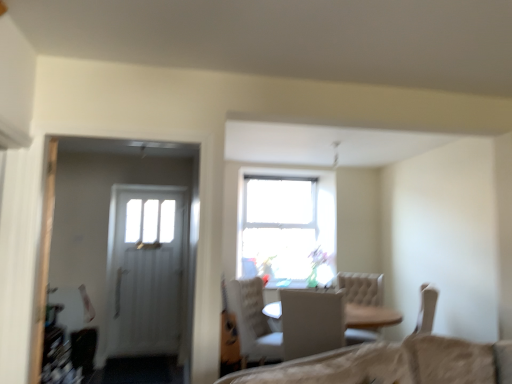
Measure the distance between white textured chair at center, the 2th chair viewed from the front, and camera.

The distance of white textured chair at center, the 2th chair viewed from the front, from camera is 11.11 feet.

Measure the distance between point (273, 335) and camera.

Point (273, 335) and camera are 3.92 meters apart from each other.

How much space does white textured chair at center, positioned as the first chair in back-to-front order, occupy horizontally?

white textured chair at center, positioned as the first chair in back-to-front order, is 25.03 inches in width.

The height and width of the screenshot is (384, 512). Describe the element at coordinates (253, 321) in the screenshot. I see `white textured chair at center, positioned as the first chair in back-to-front order` at that location.

Where is `white textured chair at center, positioned as the first chair in back-to-front order`? The height and width of the screenshot is (384, 512). white textured chair at center, positioned as the first chair in back-to-front order is located at coordinates (253, 321).

Image resolution: width=512 pixels, height=384 pixels. What do you see at coordinates (311, 322) in the screenshot?
I see `white fabric chair at center, the 1th chair when ordered from front to back` at bounding box center [311, 322].

The height and width of the screenshot is (384, 512). What are the coordinates of `white fabric chair at center, which ranks as the 2th chair in back-to-front order` in the screenshot? It's located at (311, 322).

Measure the distance between point (325, 304) and camera.

A distance of 10.04 feet exists between point (325, 304) and camera.

Where is `white textured chair at center, positioned as the first chair in back-to-front order`? The width and height of the screenshot is (512, 384). white textured chair at center, positioned as the first chair in back-to-front order is located at coordinates (253, 321).

Is white fabric chair at center, which ranks as the 2th chair in back-to-front order, to the left of white textured chair at center, the 2th chair viewed from the front, from the viewer's perspective?

Incorrect, white fabric chair at center, which ranks as the 2th chair in back-to-front order, is not on the left side of white textured chair at center, the 2th chair viewed from the front.

Which is behind, white fabric chair at center, which ranks as the 2th chair in back-to-front order, or white textured chair at center, the 2th chair viewed from the front?

white textured chair at center, the 2th chair viewed from the front, is more distant.

Considering the positions of point (303, 356) and point (256, 337), is point (303, 356) closer or farther from the camera than point (256, 337)?

Clearly, point (303, 356) is closer to the camera than point (256, 337).

From the image's perspective, relative to white textured chair at center, positioned as the first chair in back-to-front order, is white fabric chair at center, which ranks as the 2th chair in back-to-front order, above or below?

white fabric chair at center, which ranks as the 2th chair in back-to-front order, is situated higher than white textured chair at center, positioned as the first chair in back-to-front order, in the image.

From a real-world perspective, which object rests below the other?

white textured chair at center, the 2th chair viewed from the front, from a real-world perspective.

Is white fabric chair at center, which ranks as the 2th chair in back-to-front order, wider or thinner than white textured chair at center, the 2th chair viewed from the front?

In the image, white fabric chair at center, which ranks as the 2th chair in back-to-front order, appears to be wider than white textured chair at center, the 2th chair viewed from the front.

Does white fabric chair at center, which ranks as the 2th chair in back-to-front order, have a greater height compared to white textured chair at center, the 2th chair viewed from the front?

No, white fabric chair at center, which ranks as the 2th chair in back-to-front order, is not taller than white textured chair at center, the 2th chair viewed from the front.

Considering the relative sizes of white fabric chair at center, the 1th chair when ordered from front to back, and white textured chair at center, positioned as the first chair in back-to-front order, in the image provided, is white fabric chair at center, the 1th chair when ordered from front to back, smaller than white textured chair at center, positioned as the first chair in back-to-front order,?

Yes.

Is white fabric chair at center, the 1th chair when ordered from front to back, positioned beyond the bounds of white textured chair at center, the 2th chair viewed from the front?

Yes, white fabric chair at center, the 1th chair when ordered from front to back, is not within white textured chair at center, the 2th chair viewed from the front.

Are white fabric chair at center, the 1th chair when ordered from front to back, and white textured chair at center, positioned as the first chair in back-to-front order, located far from each other?

No, white fabric chair at center, the 1th chair when ordered from front to back, is not far away from white textured chair at center, positioned as the first chair in back-to-front order.

Is white fabric chair at center, the 1th chair when ordered from front to back, turned away from white textured chair at center, the 2th chair viewed from the front?

No, white textured chair at center, the 2th chair viewed from the front, is not at the back of white fabric chair at center, the 1th chair when ordered from front to back.

How many degrees apart are the facing directions of white fabric chair at center, the 1th chair when ordered from front to back, and white textured chair at center, the 2th chair viewed from the front?

The angular difference between white fabric chair at center, the 1th chair when ordered from front to back, and white textured chair at center, the 2th chair viewed from the front, is 95.3 degrees.

Measure the distance from white fabric chair at center, which ranks as the 2th chair in back-to-front order, to white textured chair at center, the 2th chair viewed from the front.

The distance of white fabric chair at center, which ranks as the 2th chair in back-to-front order, from white textured chair at center, the 2th chair viewed from the front, is 61.95 centimeters.

Where is `chair on the right of white textured chair at center, positioned as the first chair in back-to-front order`? This screenshot has height=384, width=512. chair on the right of white textured chair at center, positioned as the first chair in back-to-front order is located at coordinates pos(311,322).

Consider the image. Considering the positions of objects white textured chair at center, the 2th chair viewed from the front, and white fabric chair at center, the 1th chair when ordered from front to back, in the image provided, who is more to the right, white textured chair at center, the 2th chair viewed from the front, or white fabric chair at center, the 1th chair when ordered from front to back,?

white fabric chair at center, the 1th chair when ordered from front to back.

Is the depth of white textured chair at center, the 2th chair viewed from the front, greater than that of white fabric chair at center, which ranks as the 2th chair in back-to-front order?

Yes, white textured chair at center, the 2th chair viewed from the front, is further from the camera.

Which is in front, point (238, 283) or point (311, 295)?

The point (311, 295) is closer to the camera.

From the image's perspective, is white textured chair at center, positioned as the first chair in back-to-front order, on white fabric chair at center, which ranks as the 2th chair in back-to-front order?

No, from the image's perspective, white textured chair at center, positioned as the first chair in back-to-front order, is not above white fabric chair at center, which ranks as the 2th chair in back-to-front order.

From a real-world perspective, between white textured chair at center, the 2th chair viewed from the front, and white fabric chair at center, the 1th chair when ordered from front to back, who is vertically lower?

From a 3D spatial view, white textured chair at center, the 2th chair viewed from the front, is below.

Looking at this image, considering the sizes of objects white textured chair at center, the 2th chair viewed from the front, and white fabric chair at center, the 1th chair when ordered from front to back, in the image provided, who is wider, white textured chair at center, the 2th chair viewed from the front, or white fabric chair at center, the 1th chair when ordered from front to back,?

white fabric chair at center, the 1th chair when ordered from front to back, is wider.

Between white textured chair at center, the 2th chair viewed from the front, and white fabric chair at center, the 1th chair when ordered from front to back, which one has more height?

white textured chair at center, the 2th chair viewed from the front, is taller.

Which of these two, white textured chair at center, the 2th chair viewed from the front, or white fabric chair at center, which ranks as the 2th chair in back-to-front order, is smaller?

white fabric chair at center, which ranks as the 2th chair in back-to-front order, is smaller.

Is white textured chair at center, positioned as the first chair in back-to-front order, not within white fabric chair at center, which ranks as the 2th chair in back-to-front order?

Yes.

Is white textured chair at center, positioned as the first chair in back-to-front order, placed right next to white fabric chair at center, which ranks as the 2th chair in back-to-front order?

No.

Is white textured chair at center, positioned as the first chair in back-to-front order, facing towards white fabric chair at center, which ranks as the 2th chair in back-to-front order?

No, white textured chair at center, positioned as the first chair in back-to-front order, is not turned towards white fabric chair at center, which ranks as the 2th chair in back-to-front order.

How different are the orientations of white textured chair at center, the 2th chair viewed from the front, and white fabric chair at center, which ranks as the 2th chair in back-to-front order, in degrees?

95.3 degrees separate the facing orientations of white textured chair at center, the 2th chair viewed from the front, and white fabric chair at center, which ranks as the 2th chair in back-to-front order.

What are the coordinates of `chair lying above the white textured chair at center, the 2th chair viewed from the front (from the image's perspective)` in the screenshot? It's located at (311, 322).

In the image, there is a white fabric chair at center, the 1th chair when ordered from front to back. Identify the location of chair below it (from a real-world perspective). This screenshot has height=384, width=512. (253, 321).

At what (x,y) coordinates should I click in order to perform the action: click on chair lying in front of the white textured chair at center, positioned as the first chair in back-to-front order. Please return your answer as a coordinate pair (x, y). This screenshot has height=384, width=512. Looking at the image, I should click on (311, 322).